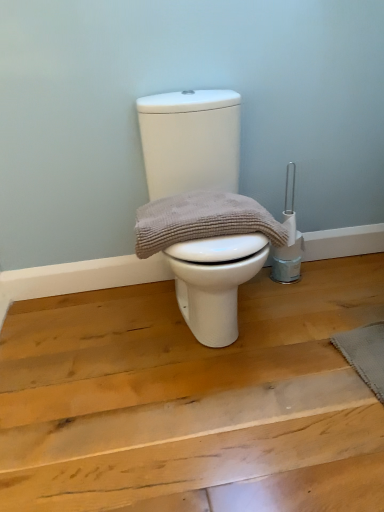
Question: Should I look upward or downward to see gray textured mat at lower right?

Choices:
 (A) up
 (B) down

Answer: (B)

Question: Does white matte toilet at center have a lesser height compared to gray textured mat at lower right?

Choices:
 (A) yes
 (B) no

Answer: (B)

Question: From a real-world perspective, is white matte toilet at center over gray textured mat at lower right?

Choices:
 (A) no
 (B) yes

Answer: (B)

Question: Can you confirm if white matte toilet at center is positioned to the right of gray textured mat at lower right?

Choices:
 (A) yes
 (B) no

Answer: (B)

Question: Is there a large distance between white matte toilet at center and gray textured mat at lower right?

Choices:
 (A) no
 (B) yes

Answer: (A)

Question: Does white matte toilet at center have a smaller size compared to gray textured mat at lower right?

Choices:
 (A) no
 (B) yes

Answer: (A)

Question: Does white matte toilet at center have a greater width compared to gray textured mat at lower right?

Choices:
 (A) no
 (B) yes

Answer: (B)

Question: Is beige textured towel at center positioned beyond the bounds of white matte toilet at center?

Choices:
 (A) no
 (B) yes

Answer: (A)

Question: Considering the relative sizes of beige textured towel at center and white matte toilet at center in the image provided, is beige textured towel at center thinner than white matte toilet at center?

Choices:
 (A) no
 (B) yes

Answer: (B)

Question: Is beige textured towel at center taller than white matte toilet at center?

Choices:
 (A) yes
 (B) no

Answer: (B)

Question: Is beige textured towel at center oriented away from white matte toilet at center?

Choices:
 (A) no
 (B) yes

Answer: (B)

Question: Is the position of beige textured towel at center more distant than that of white matte toilet at center?

Choices:
 (A) no
 (B) yes

Answer: (B)

Question: Can you confirm if beige textured towel at center is positioned to the right of white matte toilet at center?

Choices:
 (A) yes
 (B) no

Answer: (B)

Question: From a real-world perspective, is beige textured towel at center located higher than gray textured mat at lower right?

Choices:
 (A) yes
 (B) no

Answer: (A)